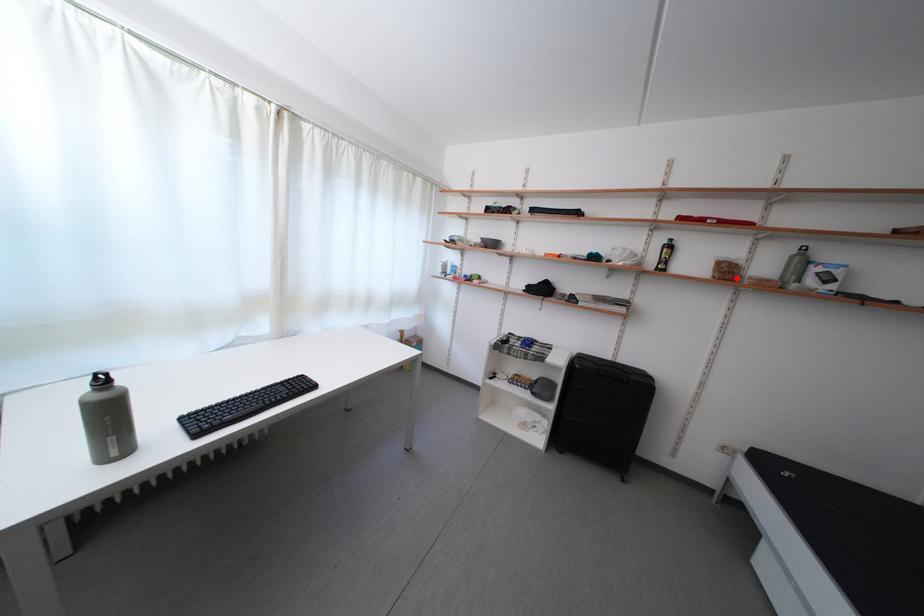
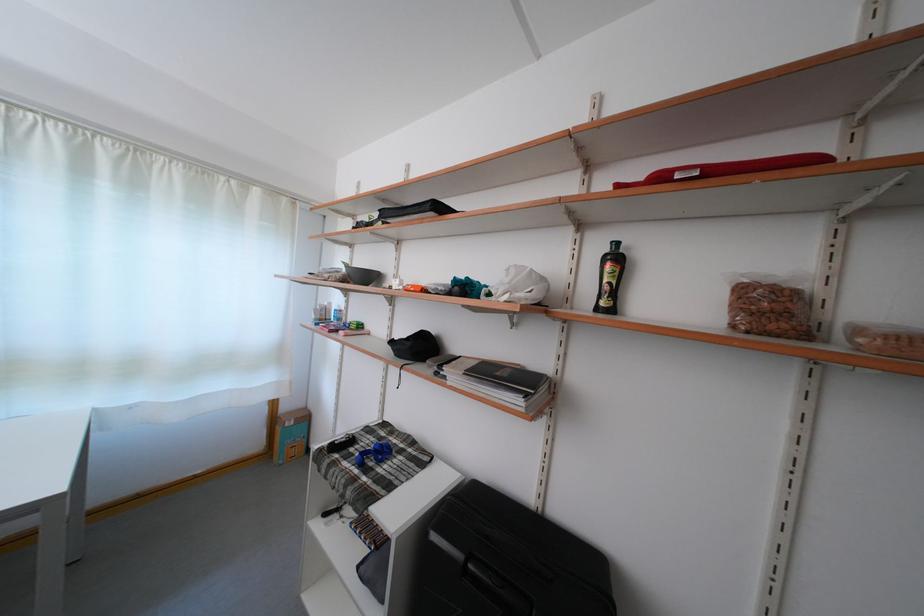
Find the pixel in the second image that matches the highlighted location in the first image.

(782, 321)